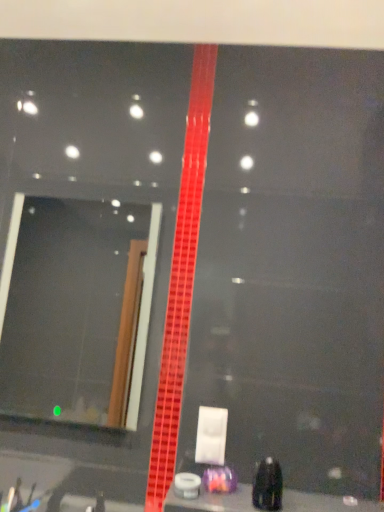
Question: Is smooth black surface at bottom aimed at black plastic bottle at lower right, positioned as the 1th toiletry in front-to-back order?

Choices:
 (A) no
 (B) yes

Answer: (A)

Question: From the image's perspective, is smooth black surface at bottom located beneath black plastic bottle at lower right, which appears as the second toiletry when viewed from the back?

Choices:
 (A) yes
 (B) no

Answer: (A)

Question: From the image's perspective, is smooth black surface at bottom above black plastic bottle at lower right, positioned as the 1th toiletry in front-to-back order?

Choices:
 (A) yes
 (B) no

Answer: (B)

Question: From a real-world perspective, is smooth black surface at bottom on top of black plastic bottle at lower right, positioned as the 1th toiletry in front-to-back order?

Choices:
 (A) no
 (B) yes

Answer: (A)

Question: Is smooth black surface at bottom closer to camera compared to black plastic bottle at lower right, which appears as the second toiletry when viewed from the back?

Choices:
 (A) yes
 (B) no

Answer: (A)

Question: Considering the relative sizes of smooth black surface at bottom and black plastic bottle at lower right, positioned as the 1th toiletry in front-to-back order, in the image provided, is smooth black surface at bottom wider than black plastic bottle at lower right, positioned as the 1th toiletry in front-to-back order,?

Choices:
 (A) yes
 (B) no

Answer: (A)

Question: Considering the relative sizes of translucent purple container at center, which is the first toiletry from left to right, and black plastic bottle at lower right, positioned as the 1th toiletry in front-to-back order, in the image provided, is translucent purple container at center, which is the first toiletry from left to right, smaller than black plastic bottle at lower right, positioned as the 1th toiletry in front-to-back order,?

Choices:
 (A) no
 (B) yes

Answer: (B)

Question: From the image's perspective, would you say translucent purple container at center, acting as the 2th toiletry starting from the right, is shown under black plastic bottle at lower right, which is the second toiletry from left to right?

Choices:
 (A) no
 (B) yes

Answer: (B)

Question: Can you confirm if translucent purple container at center, which is counted as the second toiletry, starting from the front, is bigger than black plastic bottle at lower right, which appears as the second toiletry when viewed from the back?

Choices:
 (A) no
 (B) yes

Answer: (A)

Question: From a real-world perspective, is translucent purple container at center, which is the first toiletry from left to right, below black plastic bottle at lower right, which is the first toiletry in right-to-left order?

Choices:
 (A) yes
 (B) no

Answer: (A)

Question: Considering the relative sizes of translucent purple container at center, which is counted as the second toiletry, starting from the front, and black plastic bottle at lower right, which is the second toiletry from left to right, in the image provided, is translucent purple container at center, which is counted as the second toiletry, starting from the front, taller than black plastic bottle at lower right, which is the second toiletry from left to right,?

Choices:
 (A) yes
 (B) no

Answer: (B)

Question: From a real-world perspective, is translucent purple container at center, acting as the 2th toiletry starting from the right, on top of black plastic bottle at lower right, which appears as the second toiletry when viewed from the back?

Choices:
 (A) no
 (B) yes

Answer: (A)

Question: Can you confirm if black plastic bottle at lower right, positioned as the 1th toiletry in front-to-back order, is bigger than matte glass mirror at left?

Choices:
 (A) no
 (B) yes

Answer: (A)